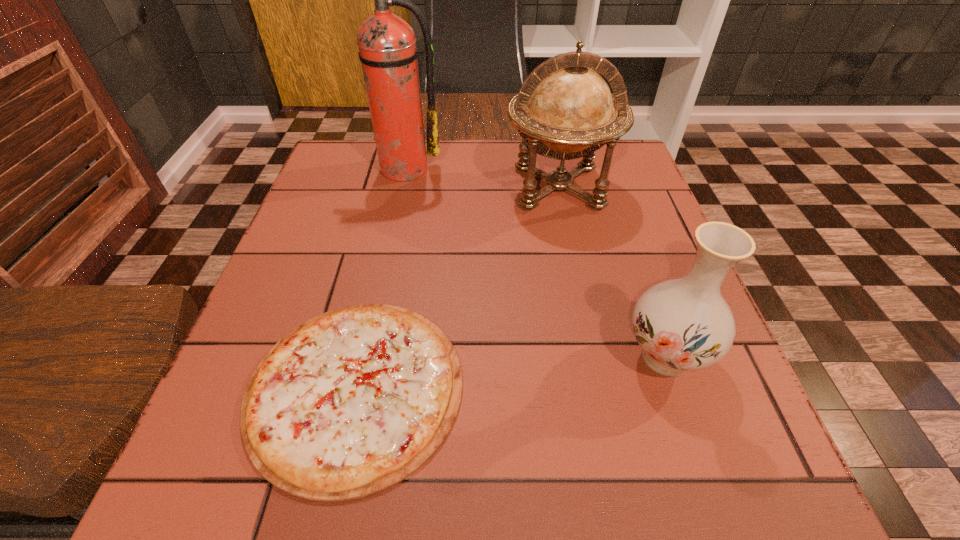
The height and width of the screenshot is (540, 960). Find the location of `vacant space at the right edge of the desktop`. vacant space at the right edge of the desktop is located at coordinates (657, 435).

This screenshot has width=960, height=540. What are the coordinates of `vacant space at the far left corner of the desktop` in the screenshot? It's located at (340, 167).

Find the location of a particular element. free region at the far right corner of the desktop is located at coordinates (626, 154).

At what (x,y) coordinates should I click in order to perform the action: click on free space at the near right corner of the desktop. Please return your answer as a coordinate pair (x, y). This screenshot has width=960, height=540. Looking at the image, I should click on (782, 487).

The image size is (960, 540). Identify the location of blank region between the third shortest object and the third tallest object. (612, 272).

What are the coordinates of `free space between the second tallest object and the fire extinguisher` in the screenshot? It's located at (480, 178).

This screenshot has height=540, width=960. In order to click on free space between the vase and the tallest object in this screenshot , I will do click(534, 262).

What are the coordinates of `unoccupied area between the third tallest object and the globe` in the screenshot? It's located at (612, 272).

Where is `unoccupied position between the second tallest object and the third tallest object`? The width and height of the screenshot is (960, 540). unoccupied position between the second tallest object and the third tallest object is located at coordinates (612, 272).

This screenshot has width=960, height=540. What are the coordinates of `free space between the fire extinguisher and the vase` in the screenshot? It's located at (534, 262).